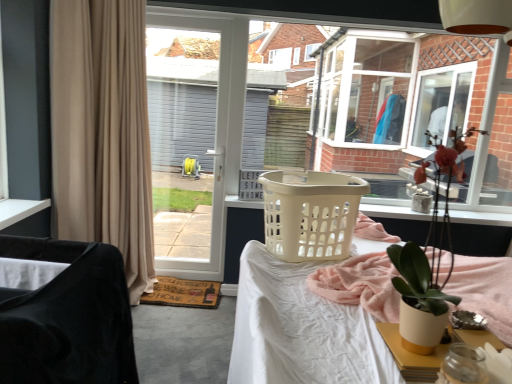
Question: In the image, is velvet black chair at left on the left side or the right side of beige fabric curtain at left?

Choices:
 (A) left
 (B) right

Answer: (B)

Question: Considering the positions of velvet black chair at left and beige fabric curtain at left in the image, is velvet black chair at left taller or shorter than beige fabric curtain at left?

Choices:
 (A) tall
 (B) short

Answer: (B)

Question: Which object is the farthest from the beige plastic laundry basket at center?

Choices:
 (A) white plastic screen door at center
 (B) transparent plastic laundry basket at center
 (C) beige fabric curtain at left
 (D) white plastic desk at center
 (E) matte white pot at right

Answer: (A)

Question: Which of these objects is positioned closest to the beige fabric curtain at left?

Choices:
 (A) white plastic desk at center
 (B) white plastic screen door at center
 (C) velvet black chair at left
 (D) transparent plastic laundry basket at center
 (E) beige plastic laundry basket at center

Answer: (E)